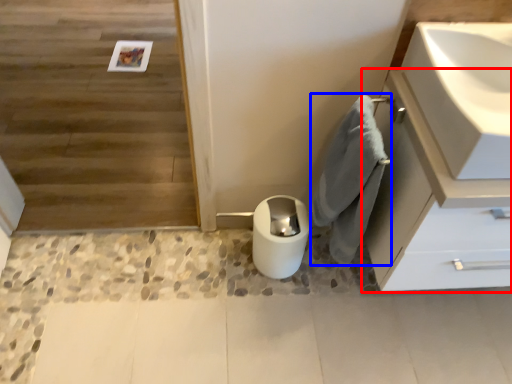
Question: Among these objects, which one is farthest to the camera, bathroom cabinet (highlighted by a red box) or bath towel (highlighted by a blue box)?

Choices:
 (A) bathroom cabinet
 (B) bath towel

Answer: (B)